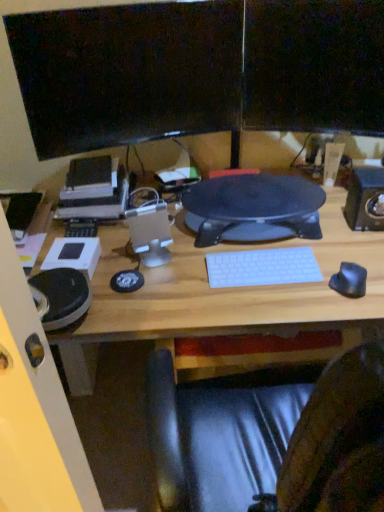
Identify the location of vacant area on top of black textured mouse pad at center (from a real-world perspective). (252, 193).